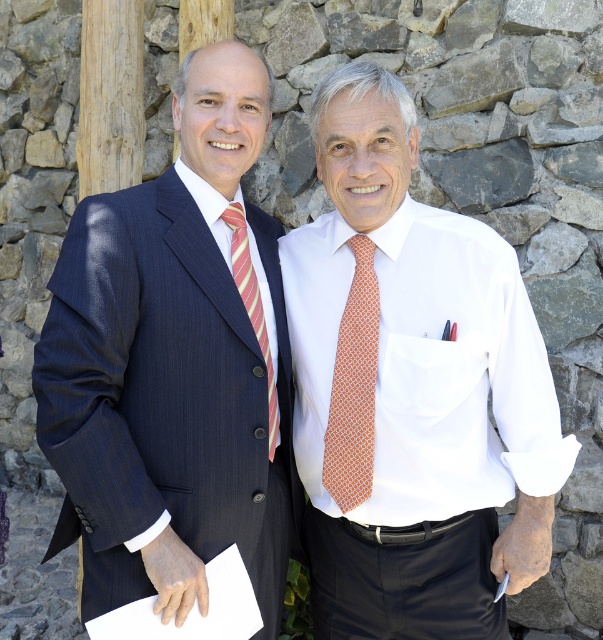
Question: Does white smooth dress shirt at center appear on the left side of white fabric pocket at center?

Choices:
 (A) no
 (B) yes

Answer: (B)

Question: Which point is farther to the camera?

Choices:
 (A) (368, 460)
 (B) (317, 276)
 (C) (256, 291)

Answer: (B)

Question: Can you confirm if white smooth dress shirt at center is positioned above orange dotted tie at center?

Choices:
 (A) no
 (B) yes

Answer: (B)

Question: Which of the following is the closest to the observer?

Choices:
 (A) orange dotted tie at center
 (B) white fabric pocket at center

Answer: (B)

Question: Which is nearer to the striped silk tie at center?

Choices:
 (A) matte blue suit at left
 (B) white smooth dress shirt at center

Answer: (A)

Question: Can you confirm if white smooth dress shirt at center is wider than striped silk tie at center?

Choices:
 (A) yes
 (B) no

Answer: (A)